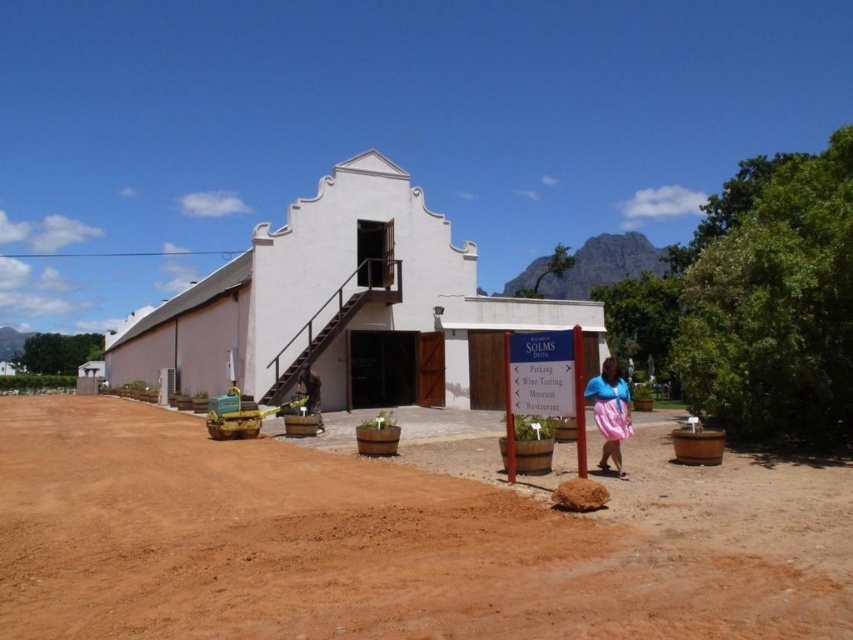
You are standing in front of the white matte building at center and the yellow fabric bag at center. Which object is closer to you?

The yellow fabric bag at center is closer to you because the white matte building at center is further away.

You are standing at the signpost in the foreground and want to go to the white matte building at center and the yellow fabric bag at center. Which one is closer to you?

The yellow fabric bag at center is closer to you because the white matte building at center is to the left of it, meaning the building is further away.

You are standing in front of the white building with a gabled roof and want to walk from the signpost to the entrance. Which of the two points, point (624,387) or point (312,404), is closer to you as you approach the entrance?

Point (624,387) is closer to the viewer than point (312,404), so it is the closer point as you approach the entrance.